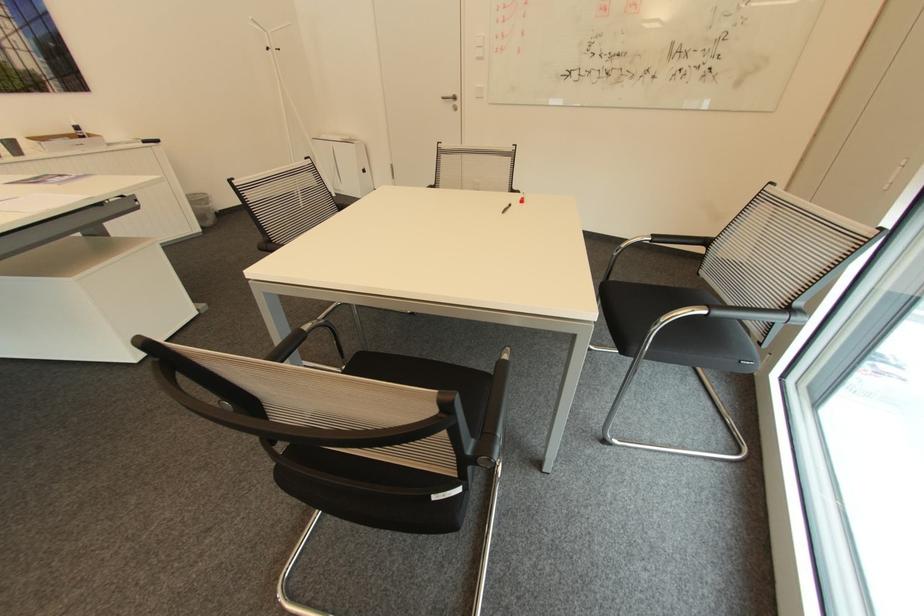
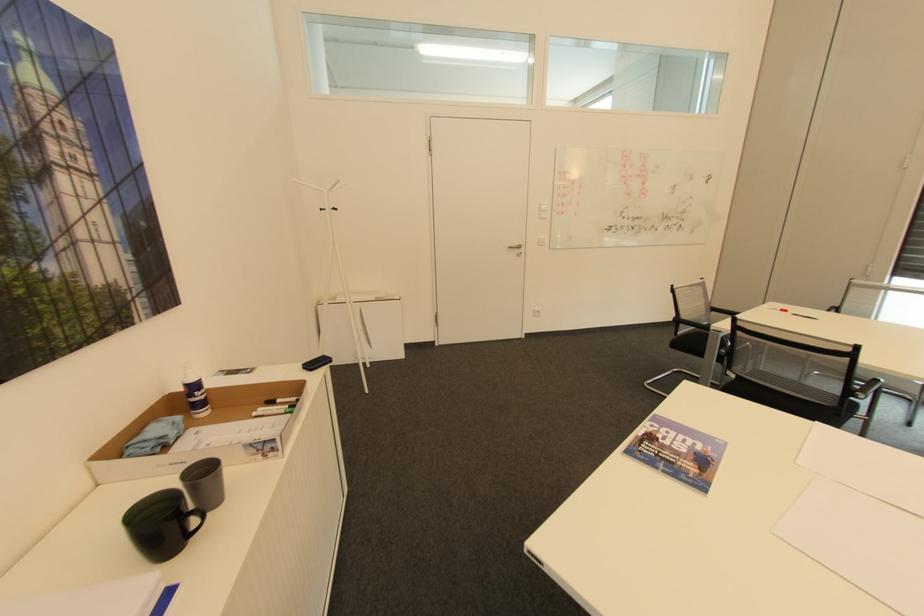
The point at (458,98) is marked in the first image. Where is the corresponding point in the second image?

(524, 246)